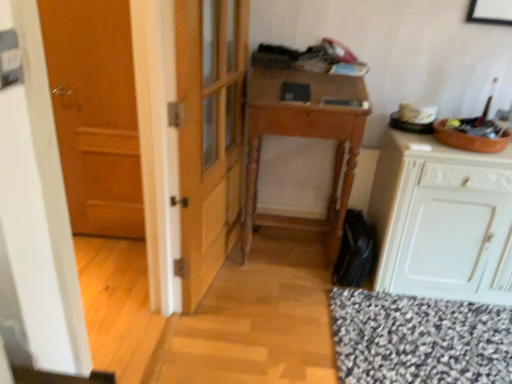
Question: Would you say wooden door at left is to the left or to the right of white painted wood cabinet at right in the picture?

Choices:
 (A) right
 (B) left

Answer: (B)

Question: From a real-world perspective, is wooden door at left positioned above or below white painted wood cabinet at right?

Choices:
 (A) above
 (B) below

Answer: (A)

Question: Which object is the closest to the wooden desk at center?

Choices:
 (A) white painted wood cabinet at right
 (B) wooden door at left

Answer: (A)

Question: Which of these objects is positioned farthest from the wooden desk at center?

Choices:
 (A) wooden door at left
 (B) white painted wood cabinet at right

Answer: (A)